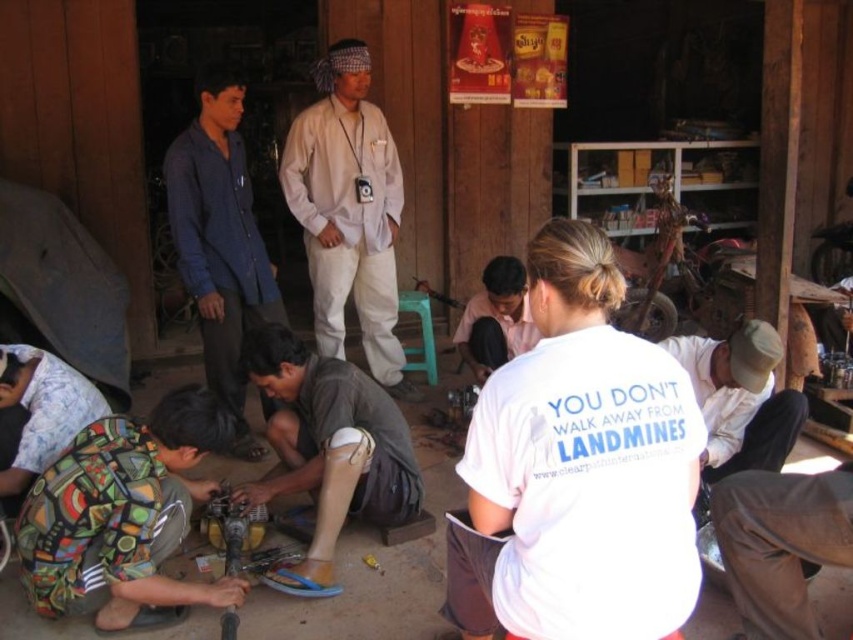
Question: Is multicolored fabric at lower left positioned before blue cotton shirt at upper left?

Choices:
 (A) yes
 (B) no

Answer: (A)

Question: Which point is farther from the camera taking this photo?

Choices:
 (A) (112, 561)
 (B) (62, 444)
 (C) (306, 184)

Answer: (C)

Question: Estimate the real-world distances between objects in this image. Which object is closer to the brown fabric prosthetic leg at lower center?

Choices:
 (A) white cotton shirt at center
 (B) printed fabric pants at lower left
 (C) multicolored fabric at lower left

Answer: (C)

Question: Estimate the real-world distances between objects in this image. Which object is farther from the multicolored fabric at lower left?

Choices:
 (A) blue cotton shirt at upper left
 (B) printed fabric pants at lower left

Answer: (A)

Question: Is white cotton shirt at center below dark gray fabric shirt at center?

Choices:
 (A) yes
 (B) no

Answer: (B)

Question: Is multicolored fabric at lower left positioned before printed fabric pants at lower left?

Choices:
 (A) no
 (B) yes

Answer: (B)